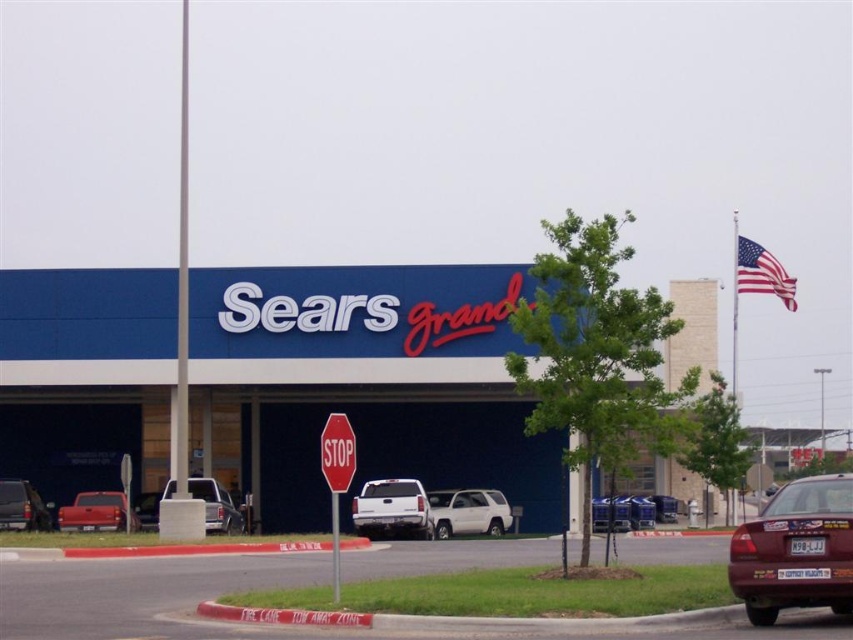
Which is above, white matte truck at center or matte red truck at lower left?

Positioned higher is white matte truck at center.

Is the position of white matte truck at center less distant than that of matte red truck at lower left?

No, white matte truck at center is further to the viewer.

Between point (393, 496) and point (109, 515), which one is positioned behind?

The point (393, 496) is behind.

Find the location of a particular element. The width and height of the screenshot is (853, 640). white matte truck at center is located at coordinates point(392,508).

Is matte red truck at lower left to the left of silver metallic truck at center from the viewer's perspective?

Yes, matte red truck at lower left is to the left of silver metallic truck at center.

Is point (106, 497) closer to camera compared to point (190, 481)?

That is False.

At what (x,y) coordinates should I click in order to perform the action: click on matte red truck at lower left. Please return your answer as a coordinate pair (x, y). Looking at the image, I should click on (96, 513).

Between white matte truck at center and matte black truck at left, which one appears on the left side from the viewer's perspective?

Positioned to the left is matte black truck at left.

Does point (381, 515) come in front of point (18, 506)?

Yes.

Image resolution: width=853 pixels, height=640 pixels. Identify the location of white matte truck at center. (392, 508).